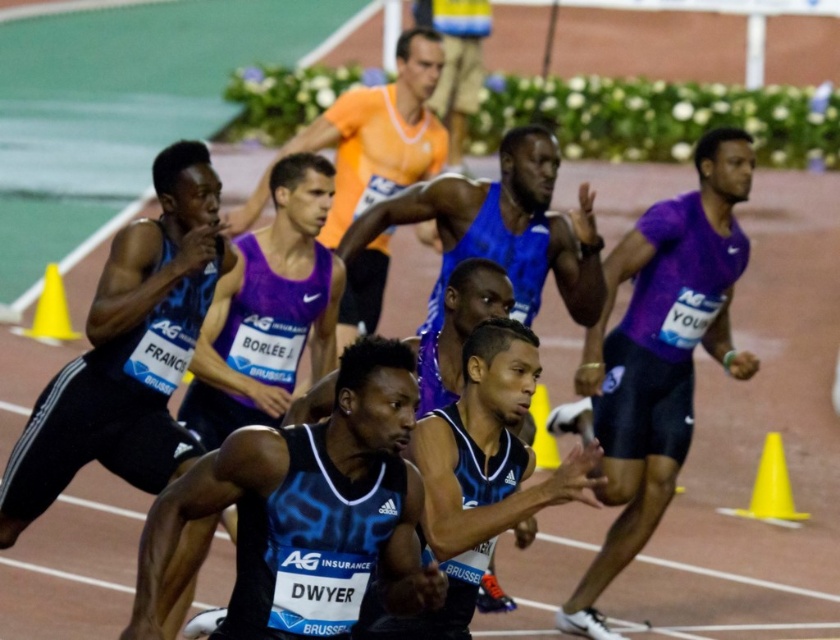
Is matte blue singlet at center to the right of orange matte shirt at upper center from the viewer's perspective?

Incorrect, matte blue singlet at center is not on the right side of orange matte shirt at upper center.

Which of these two, matte blue singlet at center or orange matte shirt at upper center, stands shorter?

With less height is orange matte shirt at upper center.

Who is more distant from viewer, [160,452] or [342,314]?

The point [342,314] is more distant.

Where is `matte blue singlet at center`? The image size is (840, 640). matte blue singlet at center is located at coordinates (129, 352).

Who is taller, matte blue singlet at center or yellow plastic cone at right?

matte blue singlet at center is taller.

Is matte blue singlet at center to the right of yellow plastic cone at right from the viewer's perspective?

In fact, matte blue singlet at center is to the left of yellow plastic cone at right.

Locate an element on the screen. The height and width of the screenshot is (640, 840). matte blue singlet at center is located at coordinates (129, 352).

This screenshot has height=640, width=840. Find the location of `matte blue singlet at center`. matte blue singlet at center is located at coordinates (129, 352).

Between orange matte shirt at upper center and yellow plastic cone at right, which one is positioned lower?

yellow plastic cone at right is lower down.

Can you confirm if orange matte shirt at upper center is positioned below yellow plastic cone at right?

Actually, orange matte shirt at upper center is above yellow plastic cone at right.

Identify the location of orange matte shirt at upper center. This screenshot has height=640, width=840. click(x=370, y=140).